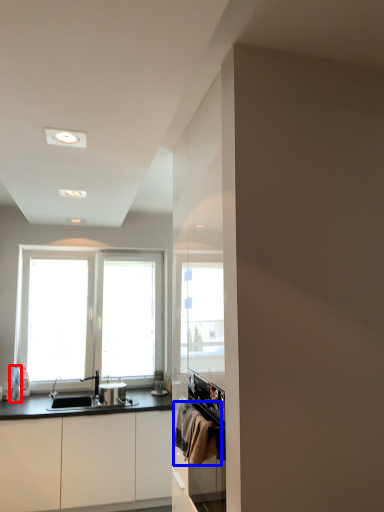
Question: Which point is closer to the camera, bottle (highlighted by a red box) or laundry (highlighted by a blue box)?

Choices:
 (A) bottle
 (B) laundry

Answer: (B)